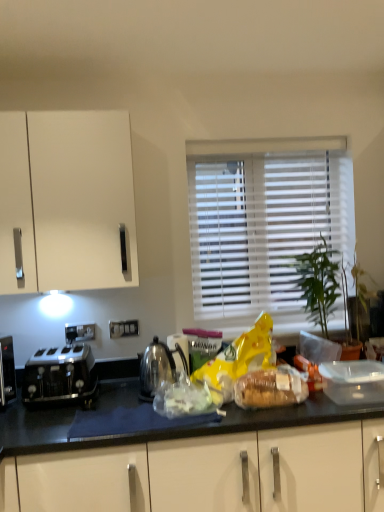
The height and width of the screenshot is (512, 384). What are the coordinates of `vacant space underneath white blinds at center (from a real-world perspective)` in the screenshot? It's located at (271, 323).